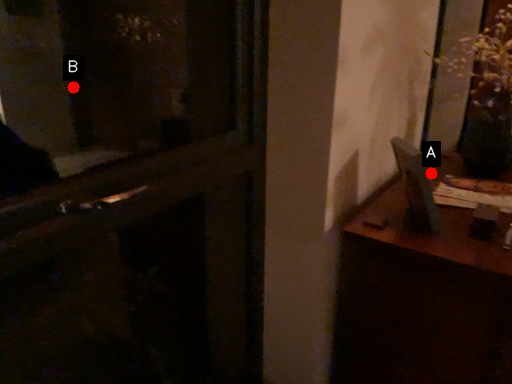
Question: Two points are circled on the image, labeled by A and B beside each circle. Among these points, which one is farthest from the camera?

Choices:
 (A) A is further
 (B) B is further

Answer: (B)